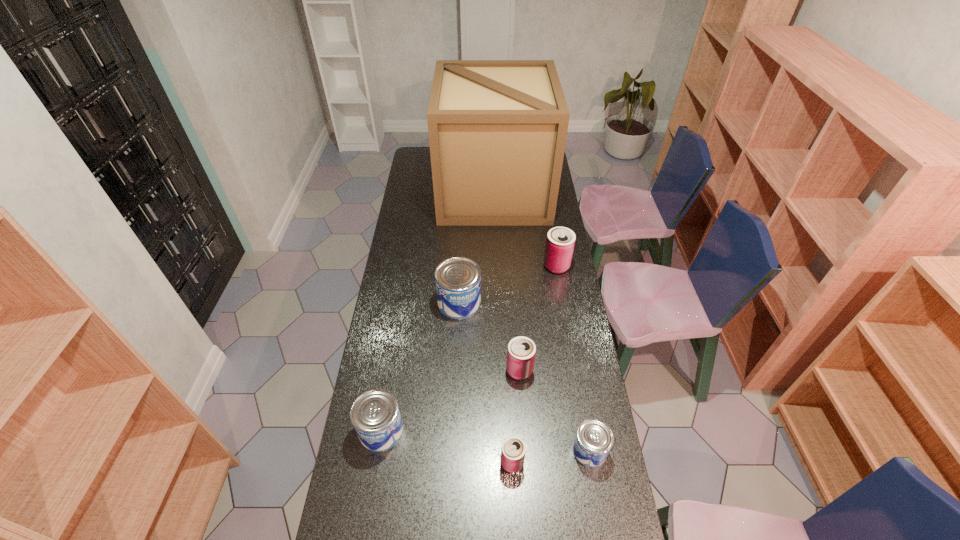
Locate an element on the screen. the smallest pink can is located at coordinates (513, 449).

Identify the location of the smallest blue can. Image resolution: width=960 pixels, height=540 pixels. (594, 438).

At what (x,y) coordinates should I click in order to perform the action: click on vacant region located 0.160m on the reinforced sides of the tallest object. Please return your answer as a coordinate pair (x, y). The image size is (960, 540). Looking at the image, I should click on (411, 191).

Identify the location of vacant space positioned 0.050m on the reinforced sides of the tallest object. (431, 191).

Find the location of `free space located 0.150m on the reinforced sides of the tallest object`. free space located 0.150m on the reinforced sides of the tallest object is located at coordinates (413, 191).

You are a GUI agent. You are given a task and a screenshot of the screen. Output one action in this format:
    pyautogui.click(x=<x>, y=<y>)
    Task: Click on the free space located on the left of the farthest pink can
    The width and height of the screenshot is (960, 540).
    Given the screenshot: What is the action you would take?
    pyautogui.click(x=512, y=266)

Where is `blank space located 0.050m on the front label of the fifth nearest object`? The width and height of the screenshot is (960, 540). blank space located 0.050m on the front label of the fifth nearest object is located at coordinates (458, 330).

Image resolution: width=960 pixels, height=540 pixels. I want to click on vacant point located on the left of the fourth nearest can, so click(478, 370).

Where is `free space located on the front label of the leftmost can`? free space located on the front label of the leftmost can is located at coordinates (486, 430).

This screenshot has height=540, width=960. Identify the location of free space located 0.220m on the back of the nearest pink can. (508, 389).